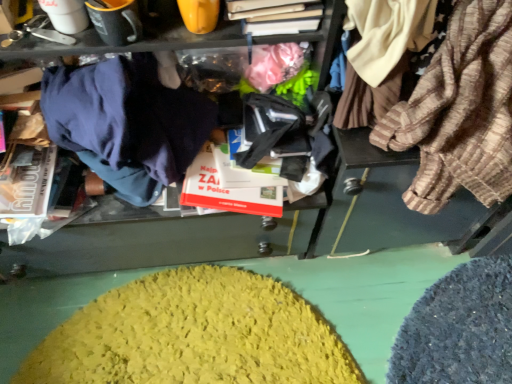
Question: Is striped cotton shirt at right, which appears as the second clothing when viewed from the left, wider than dark blue fabric at left, the second clothing positioned from the right?

Choices:
 (A) yes
 (B) no

Answer: (A)

Question: Is striped cotton shirt at right, the 1th clothing when ordered from right to left, next to dark blue fabric at left, the second clothing positioned from the right?

Choices:
 (A) yes
 (B) no

Answer: (B)

Question: Is striped cotton shirt at right, the 1th clothing when ordered from right to left, positioned beyond the bounds of dark blue fabric at left, the second clothing positioned from the right?

Choices:
 (A) no
 (B) yes

Answer: (B)

Question: Is striped cotton shirt at right, which appears as the second clothing when viewed from the left, at the left side of dark blue fabric at left, the second clothing positioned from the right?

Choices:
 (A) no
 (B) yes

Answer: (A)

Question: Would you consider striped cotton shirt at right, which appears as the second clothing when viewed from the left, to be distant from dark blue fabric at left, the second clothing positioned from the right?

Choices:
 (A) no
 (B) yes

Answer: (A)

Question: Considering their positions, is dark blue fabric at left, the first clothing viewed from the left, located in front of or behind matte white coffee cup at upper left?

Choices:
 (A) front
 (B) behind

Answer: (A)

Question: Visually, is dark blue fabric at left, the second clothing positioned from the right, positioned to the left or to the right of matte white coffee cup at upper left?

Choices:
 (A) right
 (B) left

Answer: (A)

Question: Does point (54, 129) appear closer or farther from the camera than point (82, 26)?

Choices:
 (A) closer
 (B) farther

Answer: (B)

Question: Based on their sizes in the image, would you say dark blue fabric at left, the first clothing viewed from the left, is bigger or smaller than matte white coffee cup at upper left?

Choices:
 (A) big
 (B) small

Answer: (A)

Question: From the image's perspective, is dark blue fabric at left, the second clothing positioned from the right, above or below striped cotton shirt at right, which appears as the second clothing when viewed from the left?

Choices:
 (A) below
 (B) above

Answer: (A)

Question: Does point (152, 142) appear closer or farther from the camera than point (494, 175)?

Choices:
 (A) farther
 (B) closer

Answer: (A)

Question: Looking at their shapes, would you say dark blue fabric at left, the first clothing viewed from the left, is wider or thinner than striped cotton shirt at right, the 1th clothing when ordered from right to left?

Choices:
 (A) wide
 (B) thin

Answer: (B)

Question: Based on their sizes in the image, would you say dark blue fabric at left, the second clothing positioned from the right, is bigger or smaller than striped cotton shirt at right, which appears as the second clothing when viewed from the left?

Choices:
 (A) big
 (B) small

Answer: (B)

Question: In terms of height, does dark blue fabric at left, the first clothing viewed from the left, look taller or shorter compared to yellow fuzzy rug at lower center?

Choices:
 (A) tall
 (B) short

Answer: (A)

Question: Based on their positions, is dark blue fabric at left, the first clothing viewed from the left, located to the left or right of yellow fuzzy rug at lower center?

Choices:
 (A) right
 (B) left

Answer: (B)